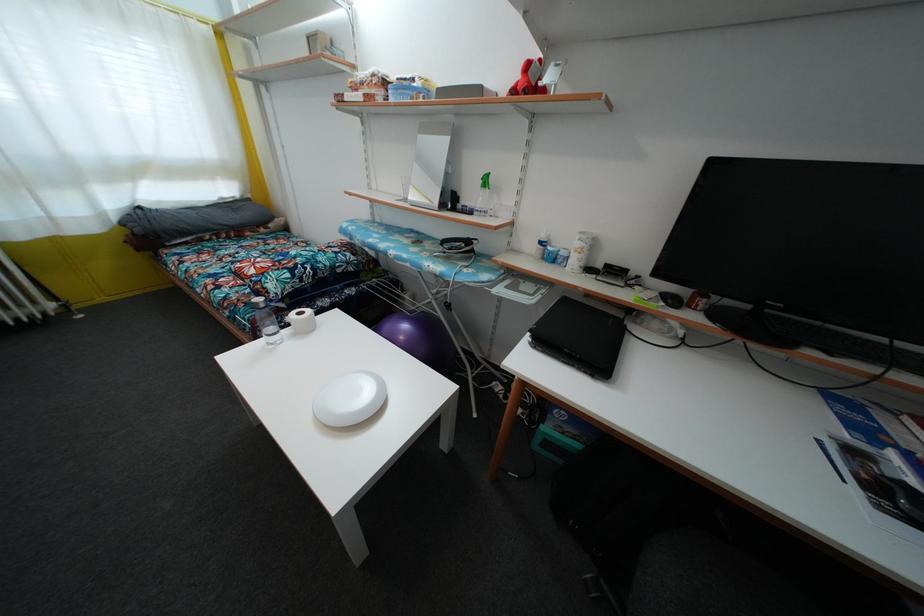
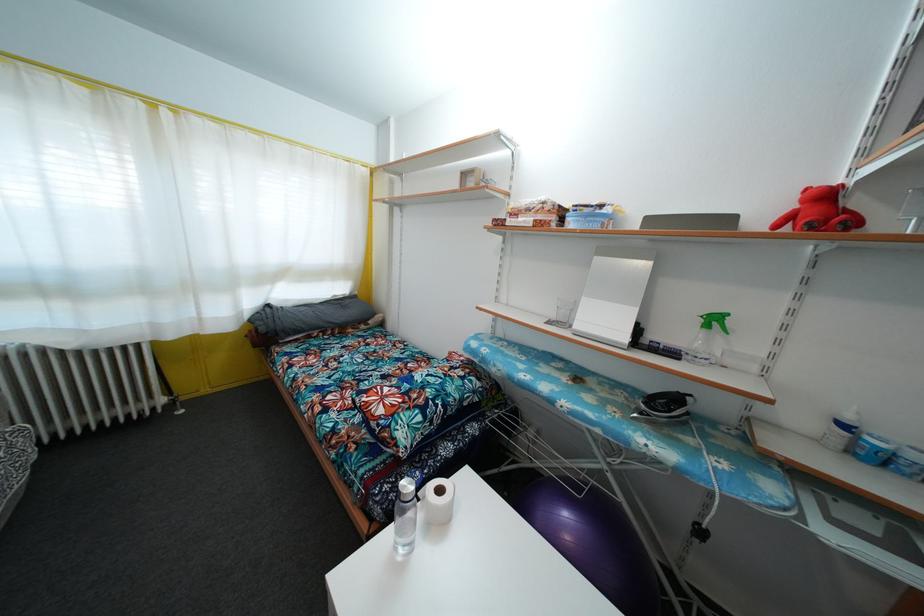
In the second image, find the point that corresponds to pixel 452 313 in the first image.

(704, 540)